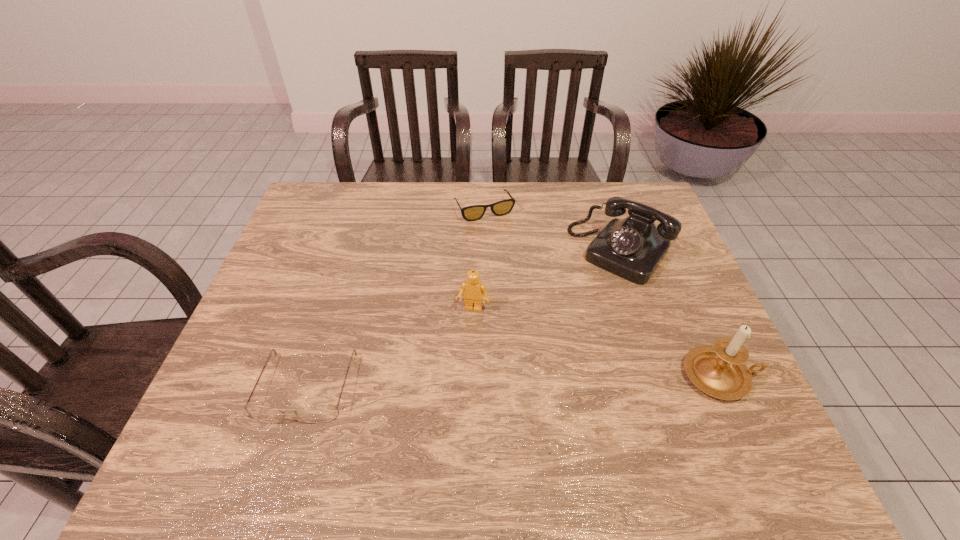
Identify the location of free space on the desktop that is between the spectacles and the tallest object and is positioned on the dial of the telephone. (516, 381).

Where is `vacant spot on the desktop that is between the leftmost object and the tallest object and is positioned on the front-facing side of the sunglasses`? vacant spot on the desktop that is between the leftmost object and the tallest object and is positioned on the front-facing side of the sunglasses is located at coordinates (573, 380).

At what (x,y) coordinates should I click in order to perform the action: click on vacant space on the desktop that is between the leftmost object and the tallest object and is positioned on the face of the Lego. Please return your answer as a coordinate pair (x, y). The image size is (960, 540). Looking at the image, I should click on (455, 383).